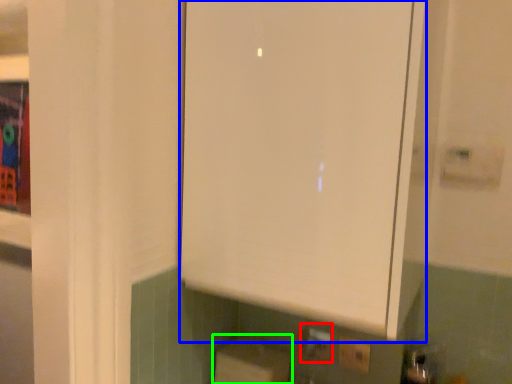
Question: Which object is positioned closest to electric outlet (highlighted by a red box)? Select from cabinetry (highlighted by a blue box) and cardboard box (highlighted by a green box).

Choices:
 (A) cabinetry
 (B) cardboard box

Answer: (B)